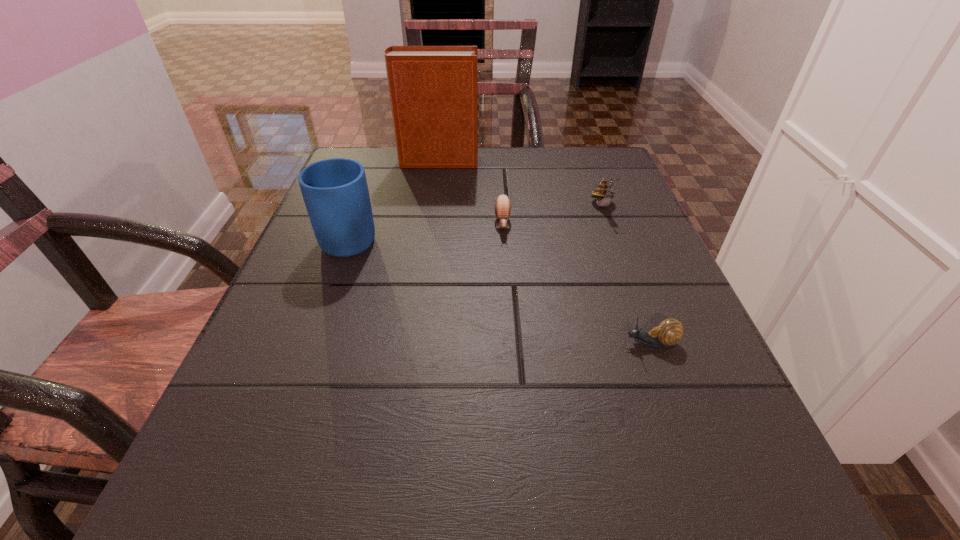
The image size is (960, 540). I want to click on empty location between the fourth shortest object and the hardback book, so click(x=395, y=198).

This screenshot has width=960, height=540. What are the coordinates of `vacant space that is in between the third object from right to left and the third shortest object` in the screenshot? It's located at (553, 215).

Locate an element on the screen. vacant area that lies between the tallest object and the leftmost escargot is located at coordinates (470, 193).

The image size is (960, 540). I want to click on empty location between the mug and the shortest escargot, so click(501, 289).

You are a GUI agent. You are given a task and a screenshot of the screen. Output one action in this format:
    pyautogui.click(x=<x>, y=<y>)
    Task: Click on the unoccupied position between the nearest escargot and the farthest object
    This screenshot has height=540, width=960.
    Given the screenshot: What is the action you would take?
    pyautogui.click(x=544, y=252)

Find the location of a particular element. Image resolution: width=960 pixels, height=540 pixels. vacant area that lies between the third tallest object and the third object from right to left is located at coordinates (553, 215).

Identify the location of vacant area that lies between the third object from left to right and the second tallest object. (427, 230).

I want to click on free space between the tallest escargot and the hardback book, so click(520, 184).

Identify which object is located as the nearest to the shortest escargot. Please provide its 2D coordinates. Your answer should be formatted as a tuple, i.e. [(x, y)], where the tuple contains the x and y coordinates of a point satisfying the conditions above.

[(502, 205)]

Identify which object is located as the second nearest to the mug. Please provide its 2D coordinates. Your answer should be formatted as a tuple, i.e. [(x, y)], where the tuple contains the x and y coordinates of a point satisfying the conditions above.

[(502, 205)]